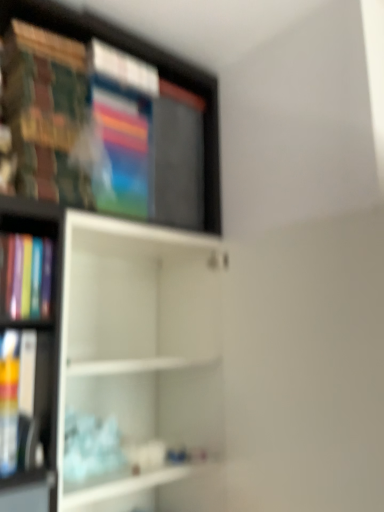
At what (x,y) coordinates should I click in order to perform the action: click on white matte shelf at center, the first shelf ordered from the bottom. Please return your answer as a coordinate pair (x, y). The height and width of the screenshot is (512, 384). Looking at the image, I should click on (136, 350).

Find the location of a particular element. wooden bookshelf at upper left, arranged as the second shelf when ordered from the bottom is located at coordinates (145, 60).

Is white matte shelf at center, arranged as the second shelf when viewed from the top, closer to camera compared to matte plastic book at left?

Yes, white matte shelf at center, arranged as the second shelf when viewed from the top, is in front of matte plastic book at left.

From the image's perspective, is white matte shelf at center, arranged as the second shelf when viewed from the top, above or below matte plastic book at left?

From the image's perspective, white matte shelf at center, arranged as the second shelf when viewed from the top, appears below matte plastic book at left.

How different are the orientations of white matte shelf at center, arranged as the second shelf when viewed from the top, and matte plastic book at left in degrees?

1.91 degrees.

This screenshot has height=512, width=384. In order to click on book behind the white matte shelf at center, the first shelf ordered from the bottom in this screenshot , I will do `click(9, 401)`.

From the image's perspective, is wooden bookshelf at upper left, which is counted as the first shelf, starting from the top, located beneath matte plastic book at left?

Actually, wooden bookshelf at upper left, which is counted as the first shelf, starting from the top, appears above matte plastic book at left in the image.

Where is `book located on the left of wooden bookshelf at upper left, which is counted as the first shelf, starting from the top`? book located on the left of wooden bookshelf at upper left, which is counted as the first shelf, starting from the top is located at coordinates (9, 401).

Considering the sizes of wooden bookshelf at upper left, arranged as the second shelf when ordered from the bottom, and matte plastic book at left in the image, is wooden bookshelf at upper left, arranged as the second shelf when ordered from the bottom, taller or shorter than matte plastic book at left?

wooden bookshelf at upper left, arranged as the second shelf when ordered from the bottom, is taller than matte plastic book at left.

Does wooden bookshelf at upper left, arranged as the second shelf when ordered from the bottom, touch matte plastic book at left?

They are not placed beside each other.

Is white matte shelf at center, the first shelf ordered from the bottom, not inside wooden bookshelf at upper left, arranged as the second shelf when ordered from the bottom?

white matte shelf at center, the first shelf ordered from the bottom, lies outside wooden bookshelf at upper left, arranged as the second shelf when ordered from the bottom,'s area.

Considering their positions, is white matte shelf at center, the first shelf ordered from the bottom, located in front of or behind wooden bookshelf at upper left, which is counted as the first shelf, starting from the top?

Clearly, white matte shelf at center, the first shelf ordered from the bottom, is in front of wooden bookshelf at upper left, which is counted as the first shelf, starting from the top.

Consider the image. Is white matte shelf at center, arranged as the second shelf when viewed from the top, at the left side of wooden bookshelf at upper left, arranged as the second shelf when ordered from the bottom?

In fact, white matte shelf at center, arranged as the second shelf when viewed from the top, is to the right of wooden bookshelf at upper left, arranged as the second shelf when ordered from the bottom.

Is wooden bookshelf at upper left, arranged as the second shelf when ordered from the bottom, aimed at white matte shelf at center, arranged as the second shelf when viewed from the top?

No, wooden bookshelf at upper left, arranged as the second shelf when ordered from the bottom, is not oriented towards white matte shelf at center, arranged as the second shelf when viewed from the top.

At what (x,y) coordinates should I click in order to perform the action: click on shelf above the white matte shelf at center, the first shelf ordered from the bottom (from the image's perspective). Please return your answer as a coordinate pair (x, y). The width and height of the screenshot is (384, 512). Looking at the image, I should click on (145, 60).

What's the angular difference between wooden bookshelf at upper left, which is counted as the first shelf, starting from the top, and white matte shelf at center, arranged as the second shelf when viewed from the top,'s facing directions?

0.167 degrees separate the facing orientations of wooden bookshelf at upper left, which is counted as the first shelf, starting from the top, and white matte shelf at center, arranged as the second shelf when viewed from the top.

Considering the sizes of objects wooden bookshelf at upper left, arranged as the second shelf when ordered from the bottom, and white matte shelf at center, the first shelf ordered from the bottom, in the image provided, who is shorter, wooden bookshelf at upper left, arranged as the second shelf when ordered from the bottom, or white matte shelf at center, the first shelf ordered from the bottom,?

Standing shorter between the two is wooden bookshelf at upper left, arranged as the second shelf when ordered from the bottom.

Between matte plastic book at left and wooden bookshelf at upper left, arranged as the second shelf when ordered from the bottom, which one is positioned in front?

matte plastic book at left.

From their relative heights in the image, would you say matte plastic book at left is taller or shorter than wooden bookshelf at upper left, arranged as the second shelf when ordered from the bottom?

In the image, matte plastic book at left appears to be shorter than wooden bookshelf at upper left, arranged as the second shelf when ordered from the bottom.

How much distance is there between matte plastic book at left and wooden bookshelf at upper left, arranged as the second shelf when ordered from the bottom?

matte plastic book at left and wooden bookshelf at upper left, arranged as the second shelf when ordered from the bottom, are 35.30 inches apart.

Considering the relative sizes of matte plastic book at left and wooden bookshelf at upper left, which is counted as the first shelf, starting from the top, in the image provided, is matte plastic book at left smaller than wooden bookshelf at upper left, which is counted as the first shelf, starting from the top,?

Yes.

Is matte plastic book at left bigger than white matte shelf at center, arranged as the second shelf when viewed from the top?

Actually, matte plastic book at left might be smaller than white matte shelf at center, arranged as the second shelf when viewed from the top.

Is matte plastic book at left oriented away from white matte shelf at center, the first shelf ordered from the bottom?

No, matte plastic book at left is not facing away from white matte shelf at center, the first shelf ordered from the bottom.

Choose the correct answer: Is matte plastic book at left inside white matte shelf at center, the first shelf ordered from the bottom, or outside it?

matte plastic book at left cannot be found inside white matte shelf at center, the first shelf ordered from the bottom.

From the image's perspective, relative to white matte shelf at center, the first shelf ordered from the bottom, is matte plastic book at left above or below?

From the image's perspective, matte plastic book at left appears above white matte shelf at center, the first shelf ordered from the bottom.

Locate an element on the screen. The width and height of the screenshot is (384, 512). shelf located underneath the matte plastic book at left (from a real-world perspective) is located at coordinates (136, 350).

The width and height of the screenshot is (384, 512). I want to click on shelf above the matte plastic book at left (from the image's perspective), so click(x=145, y=60).

Estimate the real-world distances between objects in this image. Which object is further from wooden bookshelf at upper left, arranged as the second shelf when ordered from the bottom, matte plastic book at left or white matte shelf at center, arranged as the second shelf when viewed from the top?

matte plastic book at left.

In the scene shown: Looking at the image, which one is located further to matte plastic book at left, wooden bookshelf at upper left, arranged as the second shelf when ordered from the bottom, or white matte shelf at center, the first shelf ordered from the bottom?

wooden bookshelf at upper left, arranged as the second shelf when ordered from the bottom, is further to matte plastic book at left.

Estimate the real-world distances between objects in this image. Which object is further from white matte shelf at center, the first shelf ordered from the bottom, wooden bookshelf at upper left, arranged as the second shelf when ordered from the bottom, or matte plastic book at left?

matte plastic book at left is further to white matte shelf at center, the first shelf ordered from the bottom.

Based on their spatial positions, is white matte shelf at center, the first shelf ordered from the bottom, or matte plastic book at left closer to wooden bookshelf at upper left, which is counted as the first shelf, starting from the top?

The object closer to wooden bookshelf at upper left, which is counted as the first shelf, starting from the top, is white matte shelf at center, the first shelf ordered from the bottom.

Estimate the real-world distances between objects in this image. Which object is further from white matte shelf at center, the first shelf ordered from the bottom, matte plastic book at left or wooden bookshelf at upper left, which is counted as the first shelf, starting from the top?

matte plastic book at left lies further to white matte shelf at center, the first shelf ordered from the bottom, than the other object.

Which object lies further to the anchor point matte plastic book at left, white matte shelf at center, arranged as the second shelf when viewed from the top, or wooden bookshelf at upper left, arranged as the second shelf when ordered from the bottom?

wooden bookshelf at upper left, arranged as the second shelf when ordered from the bottom, is positioned further to the anchor matte plastic book at left.

Locate an element on the screen. This screenshot has width=384, height=512. book between wooden bookshelf at upper left, which is counted as the first shelf, starting from the top, and white matte shelf at center, the first shelf ordered from the bottom, from top to bottom is located at coordinates (9, 401).